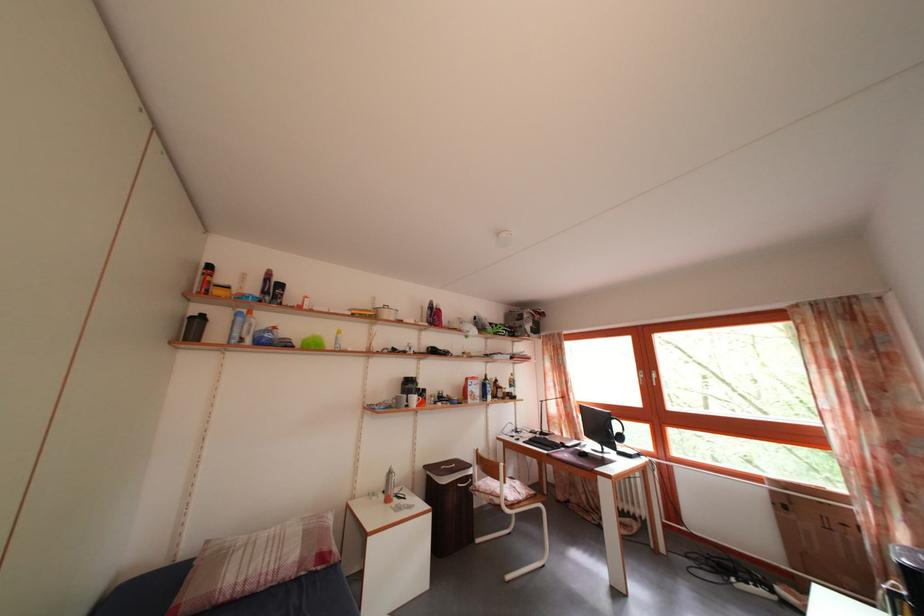
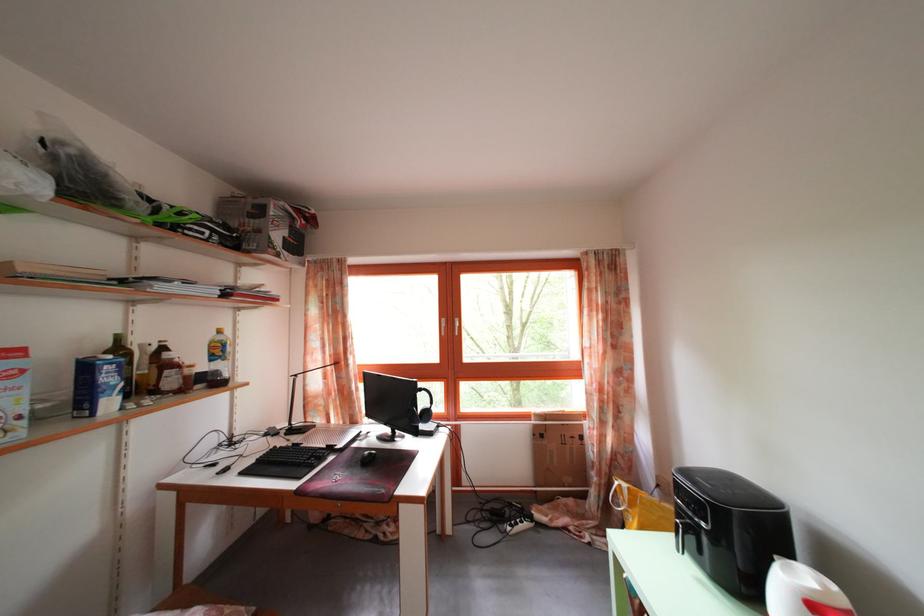
The point at (493, 383) is marked in the first image. Where is the corresponding point in the second image?

(126, 346)